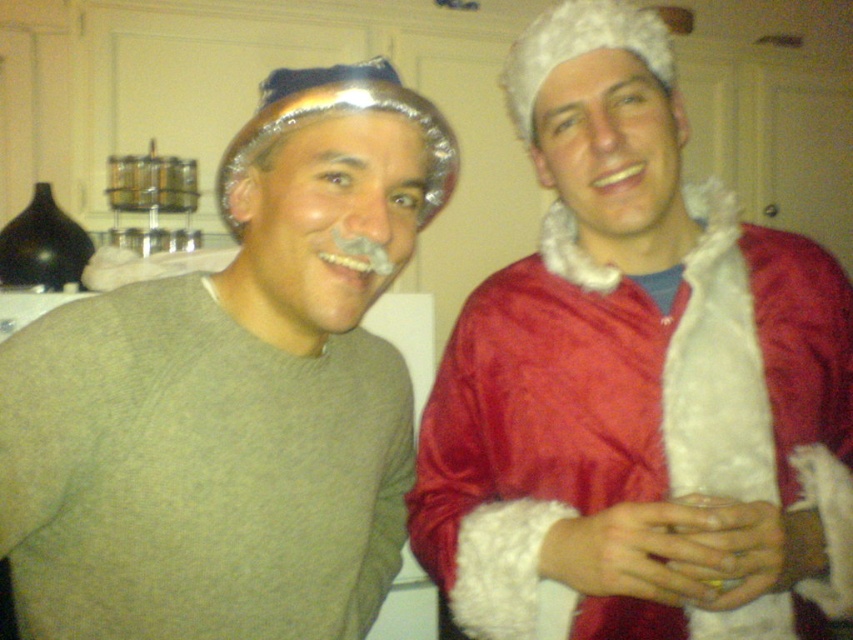
What are the coordinates of the red velvet santa coat at right?

The red velvet santa coat at right is located at point (637, 381).

You are organizing a holiday party and need to determine which coat can accommodate more layers underneath based on their size. Which coat between the red velvet santa coat at right and the matte gray sweater at left would allow for more layers?

The red velvet santa coat at right is larger in size than the matte gray sweater at left, so it can accommodate more layers underneath.